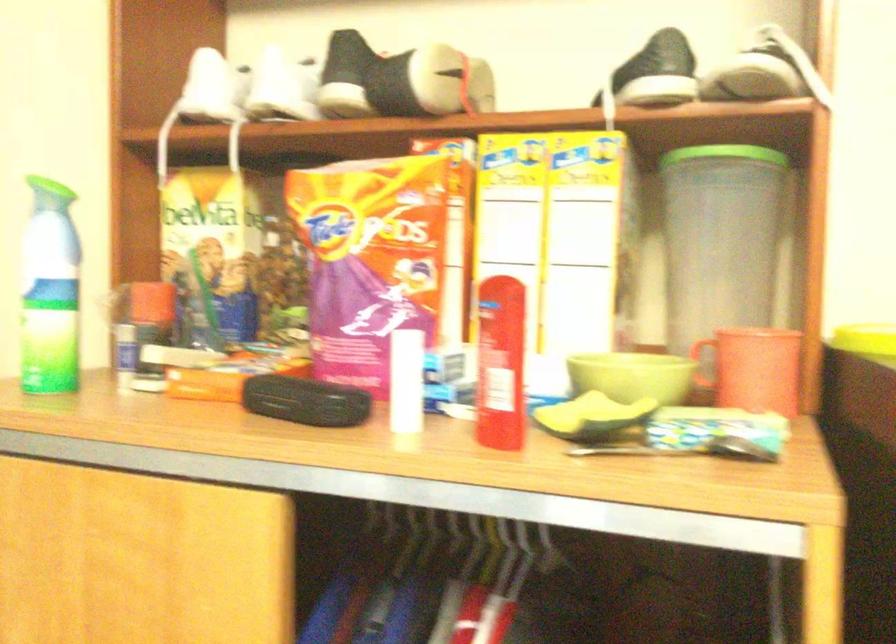
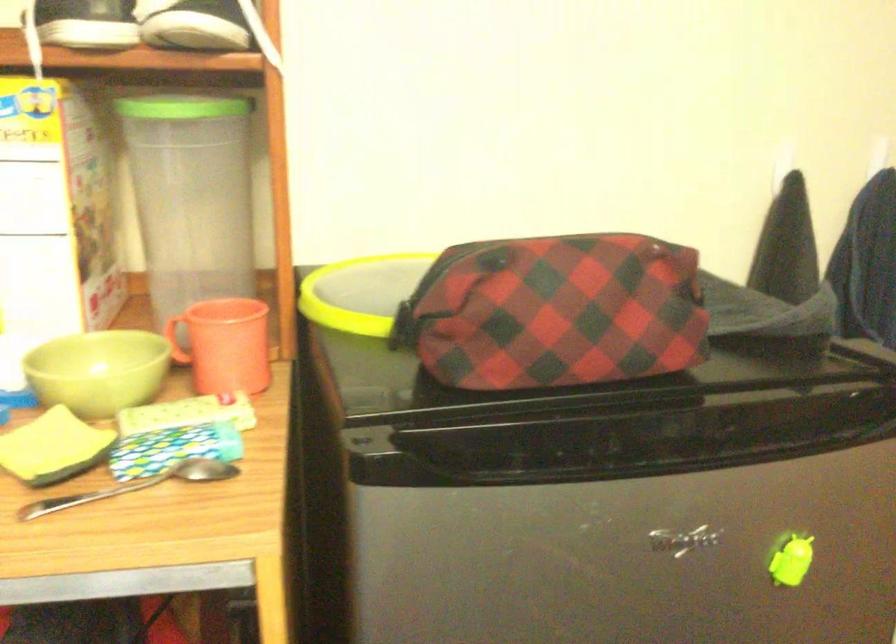
First-person continuous shooting, in which direction is the camera rotating?

The camera rotated toward right-down.